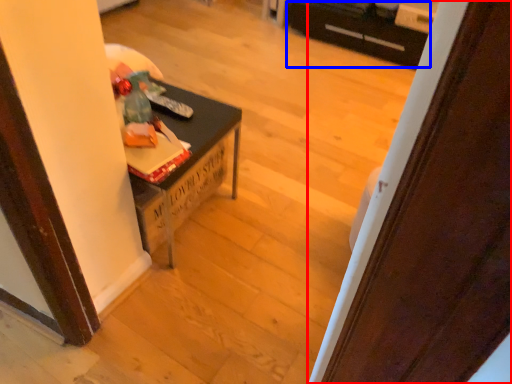
Question: Which point is closer to the camera, door (highlighted by a red box) or drawer (highlighted by a blue box)?

Choices:
 (A) door
 (B) drawer

Answer: (A)